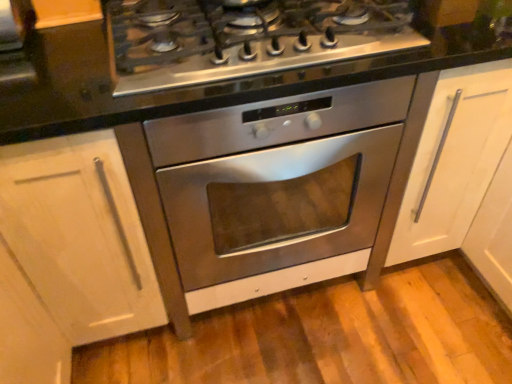
Question: Is stainless steel cooktop at center to the left of stainless steel oven at center from the viewer's perspective?

Choices:
 (A) no
 (B) yes

Answer: (B)

Question: Considering the relative sizes of stainless steel cooktop at center and stainless steel oven at center in the image provided, is stainless steel cooktop at center wider than stainless steel oven at center?

Choices:
 (A) yes
 (B) no

Answer: (B)

Question: Is stainless steel cooktop at center placed right next to stainless steel oven at center?

Choices:
 (A) no
 (B) yes

Answer: (A)

Question: Is stainless steel cooktop at center looking in the opposite direction of stainless steel oven at center?

Choices:
 (A) yes
 (B) no

Answer: (B)

Question: Would you say stainless steel oven at center is part of stainless steel cooktop at center's contents?

Choices:
 (A) yes
 (B) no

Answer: (B)

Question: From a real-world perspective, is stainless steel cooktop at center on top of stainless steel oven at center?

Choices:
 (A) yes
 (B) no

Answer: (A)

Question: Is stainless steel oven at center to the right of stainless steel cooktop at center from the viewer's perspective?

Choices:
 (A) yes
 (B) no

Answer: (A)

Question: Is stainless steel oven at center aimed at stainless steel cooktop at center?

Choices:
 (A) no
 (B) yes

Answer: (A)

Question: Can you confirm if stainless steel oven at center is positioned to the left of stainless steel cooktop at center?

Choices:
 (A) yes
 (B) no

Answer: (B)

Question: Can you confirm if stainless steel oven at center is taller than stainless steel cooktop at center?

Choices:
 (A) no
 (B) yes

Answer: (B)

Question: Is the depth of stainless steel oven at center greater than that of stainless steel cooktop at center?

Choices:
 (A) no
 (B) yes

Answer: (B)

Question: Is stainless steel oven at center positioned with its back to stainless steel cooktop at center?

Choices:
 (A) no
 (B) yes

Answer: (A)

Question: From a real-world perspective, relative to stainless steel oven at center, is stainless steel cooktop at center vertically above or below?

Choices:
 (A) below
 (B) above

Answer: (B)